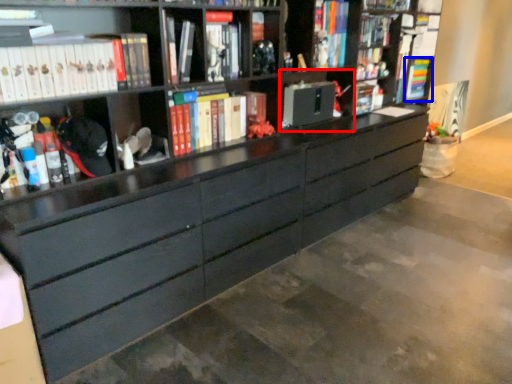
Question: Among these objects, which one is nearest to the camera, cabinet (highlighted by a red box) or book (highlighted by a blue box)?

Choices:
 (A) cabinet
 (B) book

Answer: (A)